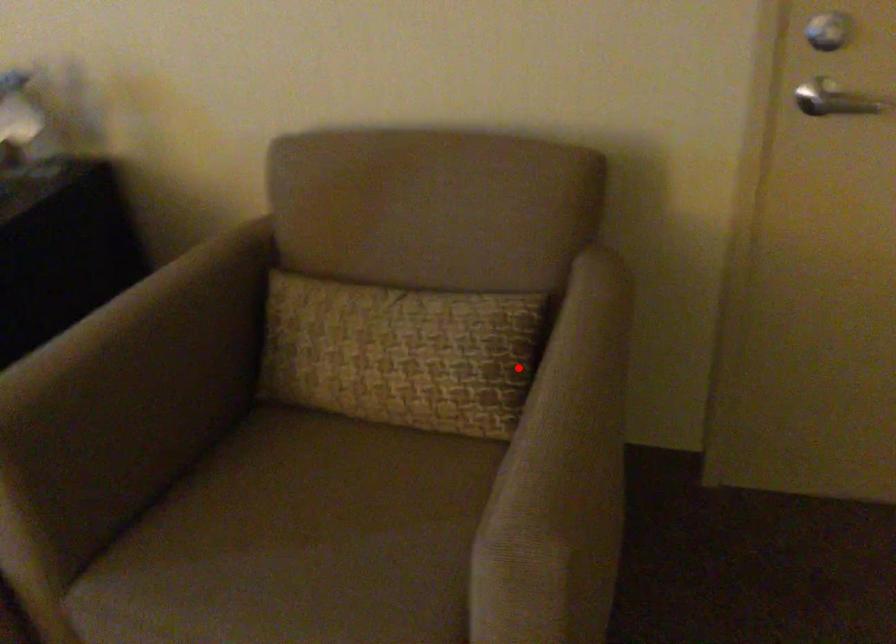
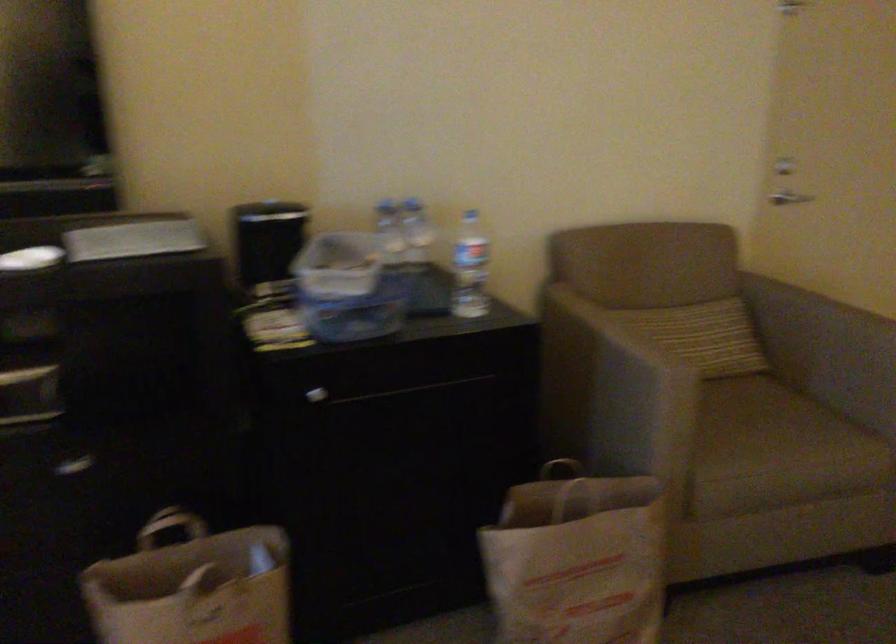
Locate, in the second image, the point that corresponds to the highlighted location in the first image.

(807, 308)